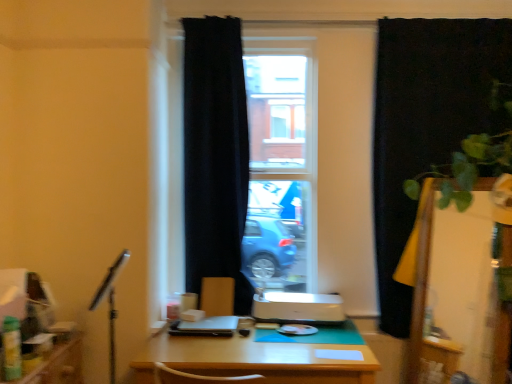
The width and height of the screenshot is (512, 384). In order to click on empty space that is ontop of white glossy printer at center (from a real-world perspective) in this screenshot , I will do (x=300, y=295).